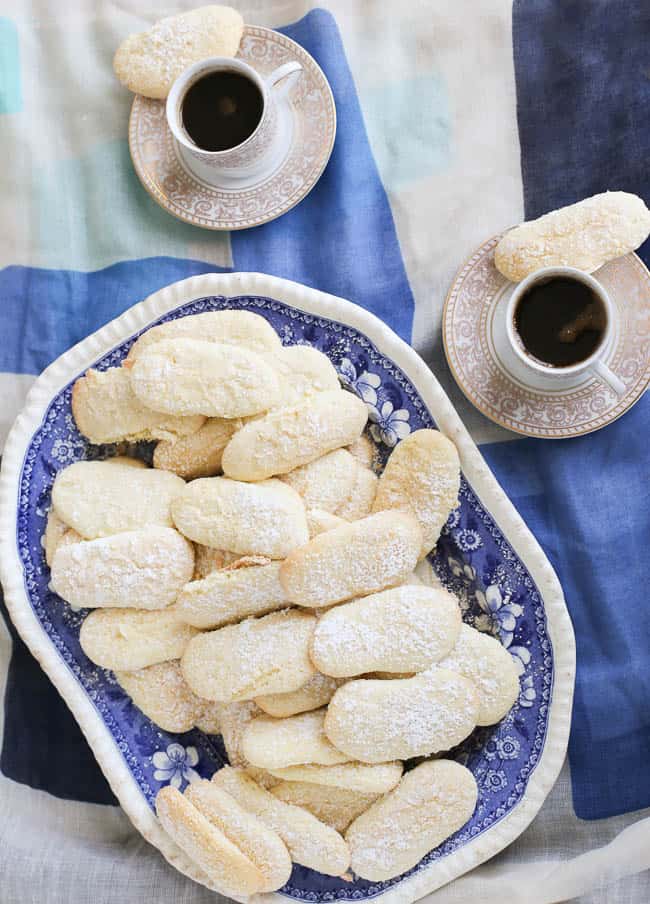
What are the coordinates of `gold trim` in the screenshot? It's located at (444, 318), (298, 202).